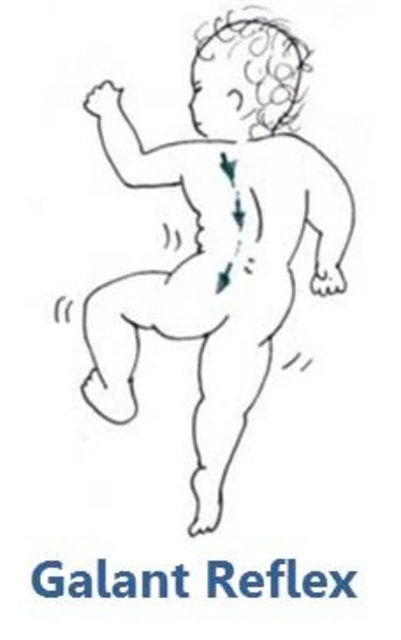
Is white line drawing of baby at center smaller than blue text galant reflex at center?

No.

I want to click on white line drawing of baby at center, so click(x=220, y=240).